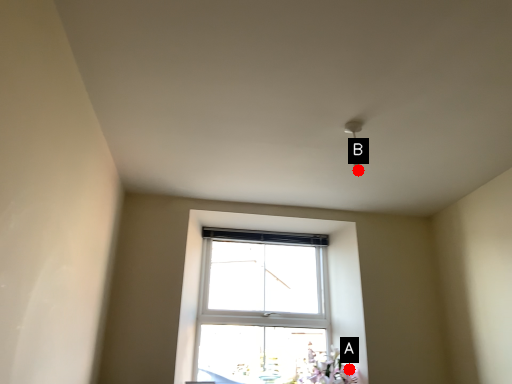
Question: Two points are circled on the image, labeled by A and B beside each circle. Which point is closer to the camera?

Choices:
 (A) A is closer
 (B) B is closer

Answer: (B)